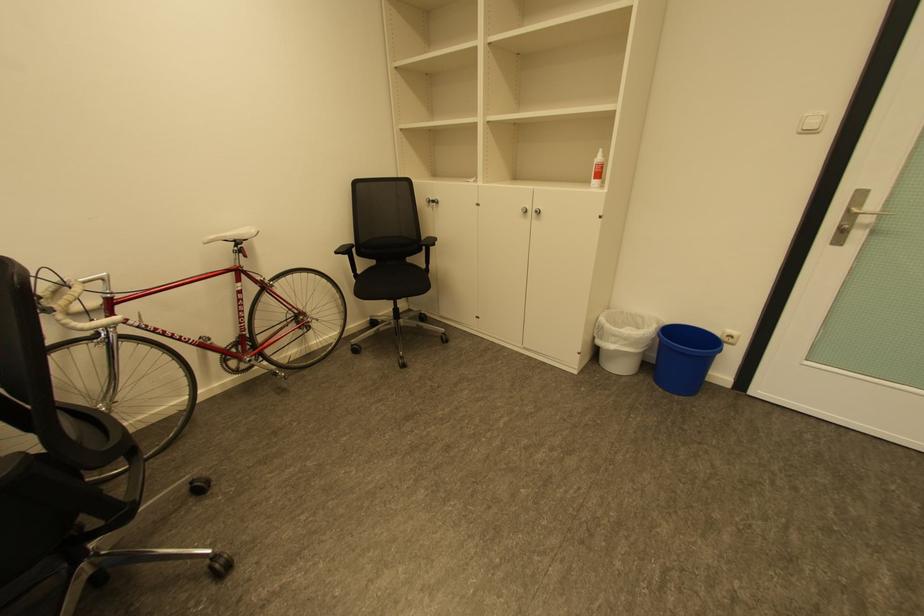
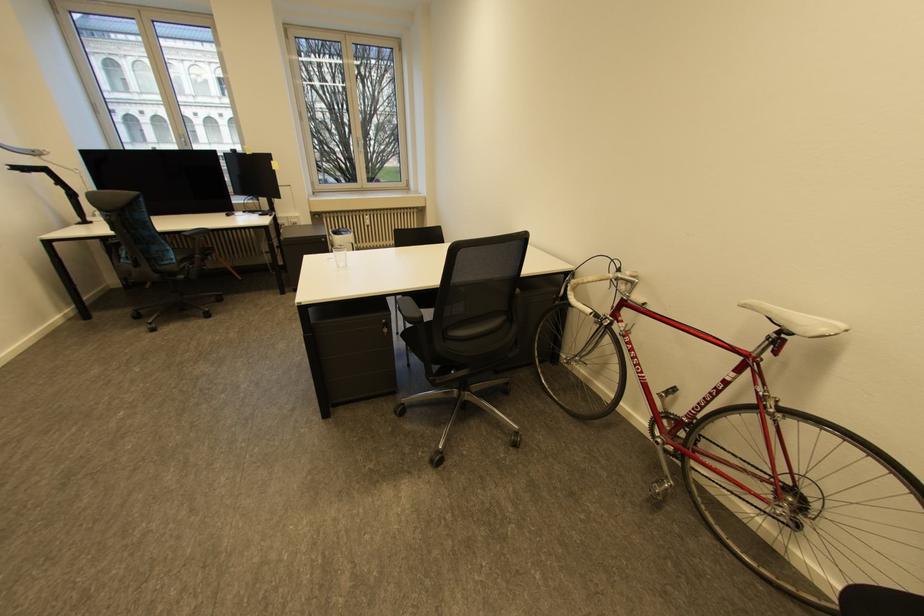
Find the pixel in the second image that matches point 245,245 in the first image.

(789, 331)